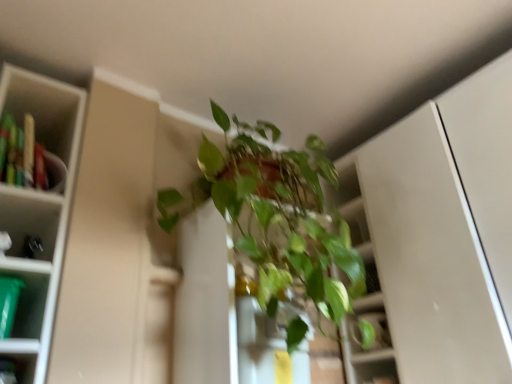
Question: Is point (28, 259) positioned closer to the camera than point (74, 100)?

Choices:
 (A) closer
 (B) farther

Answer: (A)

Question: Based on their sizes in the image, would you say green plastic container at left is bigger or smaller than green plastic container at left?

Choices:
 (A) big
 (B) small

Answer: (B)

Question: Which object is the farthest from the green plastic container at left?

Choices:
 (A) green glossy plant at center
 (B) green plastic container at left

Answer: (A)

Question: Considering the real-world distances, which object is farthest from the green plastic container at left?

Choices:
 (A) green glossy plant at center
 (B) green plastic container at left

Answer: (A)